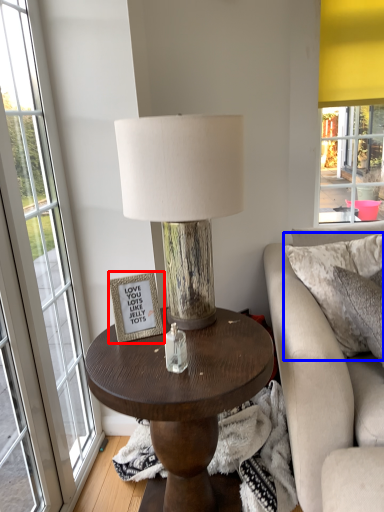
Question: Which of the following is the farthest to the observer, picture frame (highlighted by a red box) or pillow (highlighted by a blue box)?

Choices:
 (A) picture frame
 (B) pillow

Answer: (B)